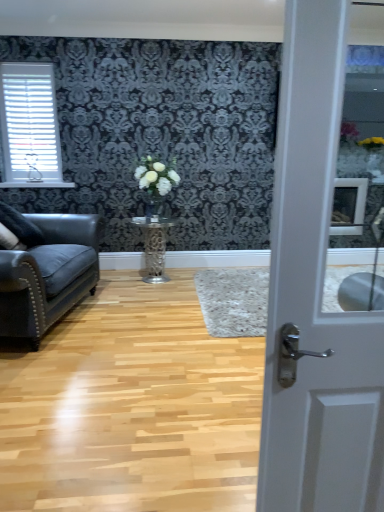
Question: From a real-world perspective, is black faux fur pillow at left located beneath white glossy door at center?

Choices:
 (A) yes
 (B) no

Answer: (A)

Question: Is black faux fur pillow at left placed right next to white glossy door at center?

Choices:
 (A) yes
 (B) no

Answer: (B)

Question: Is black faux fur pillow at left positioned in front of white glossy door at center?

Choices:
 (A) yes
 (B) no

Answer: (B)

Question: Can you confirm if black faux fur pillow at left is shorter than white glossy door at center?

Choices:
 (A) yes
 (B) no

Answer: (A)

Question: Can you confirm if black faux fur pillow at left is positioned to the left of white glossy door at center?

Choices:
 (A) yes
 (B) no

Answer: (A)

Question: Is black faux fur pillow at left facing towards white glossy door at center?

Choices:
 (A) yes
 (B) no

Answer: (B)

Question: From a real-world perspective, is white plastic blinds at upper left over metallic silver table at center?

Choices:
 (A) yes
 (B) no

Answer: (A)

Question: Is metallic silver table at center at the back of white plastic blinds at upper left?

Choices:
 (A) yes
 (B) no

Answer: (B)

Question: Is white plastic blinds at upper left taller than metallic silver table at center?

Choices:
 (A) yes
 (B) no

Answer: (A)

Question: Does white plastic blinds at upper left have a greater width compared to metallic silver table at center?

Choices:
 (A) no
 (B) yes

Answer: (A)

Question: Can you confirm if white plastic blinds at upper left is positioned to the right of metallic silver table at center?

Choices:
 (A) yes
 (B) no

Answer: (B)

Question: From a real-world perspective, is white plastic blinds at upper left located beneath metallic silver table at center?

Choices:
 (A) yes
 (B) no

Answer: (B)

Question: From a real-world perspective, is white glossy vase at center positioned under wooden floor at center based on gravity?

Choices:
 (A) no
 (B) yes

Answer: (A)